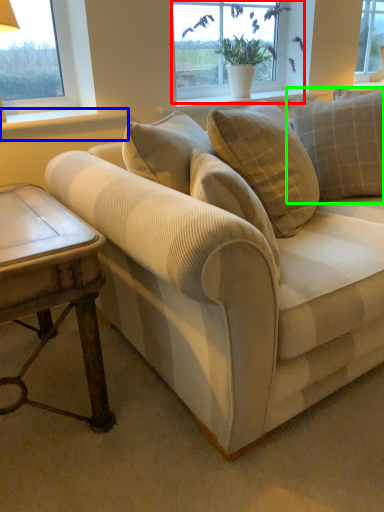
Question: Based on their relative distances, which object is farther from window (highlighted by a red box)? Choose from window sill (highlighted by a blue box) and pillow (highlighted by a green box).

Choices:
 (A) window sill
 (B) pillow

Answer: (A)